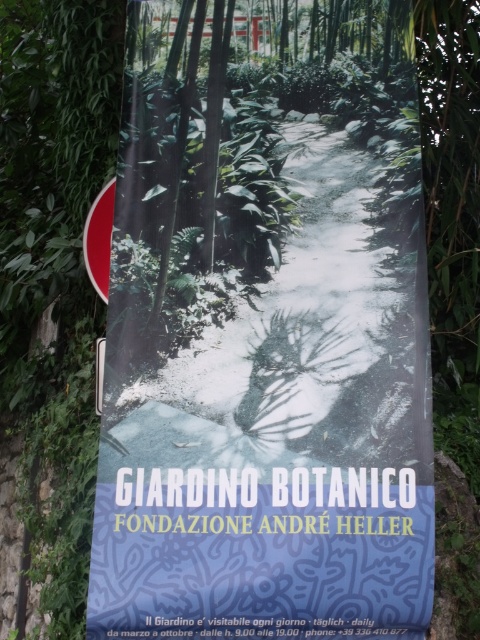
Between matte black signboard at center and matte red sign at upper left, which one is positioned higher?

matte red sign at upper left

Is matte black signboard at center bigger than matte red sign at upper left?

Indeed, matte black signboard at center has a larger size compared to matte red sign at upper left.

What do you see at coordinates (266, 353) in the screenshot? This screenshot has height=640, width=480. I see `matte black signboard at center` at bounding box center [266, 353].

Where is `matte black signboard at center`? This screenshot has height=640, width=480. matte black signboard at center is located at coordinates (266, 353).